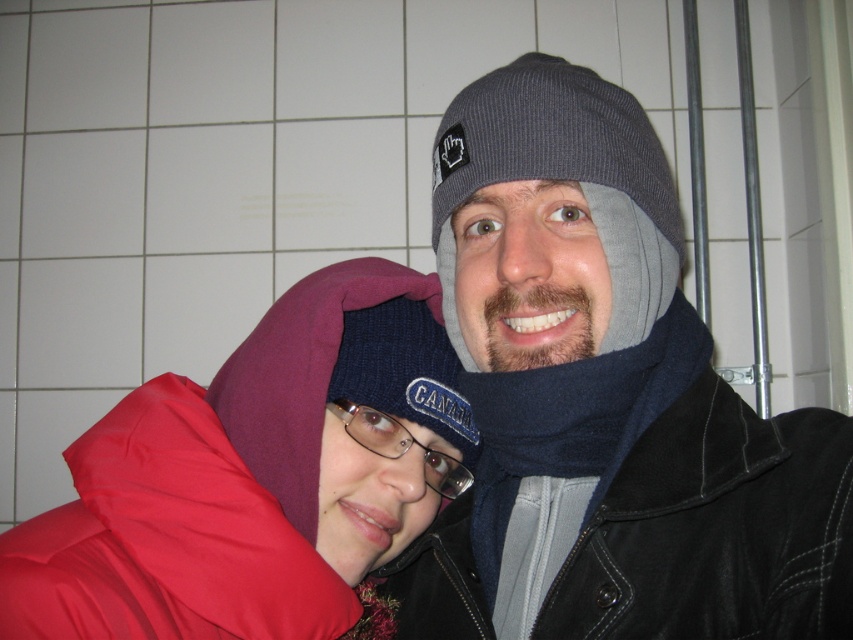
Question: Which point is closer to the camera taking this photo?

Choices:
 (A) (543, 468)
 (B) (277, 400)

Answer: (B)

Question: Is matte red jacket at lower left further to camera compared to navy wool scarf at right?

Choices:
 (A) yes
 (B) no

Answer: (B)

Question: Observing the image, what is the correct spatial positioning of navy wool scarf at right in reference to gray knit beanie at center?

Choices:
 (A) below
 (B) above

Answer: (A)

Question: In this image, where is navy wool scarf at right located relative to gray knit beanie at center?

Choices:
 (A) above
 (B) below

Answer: (B)

Question: Which object is the farthest from the matte red jacket at lower left?

Choices:
 (A) navy wool scarf at right
 (B) gray knit beanie at center

Answer: (B)

Question: Which point is farther to the camera?

Choices:
 (A) navy wool scarf at right
 (B) matte red jacket at lower left

Answer: (A)